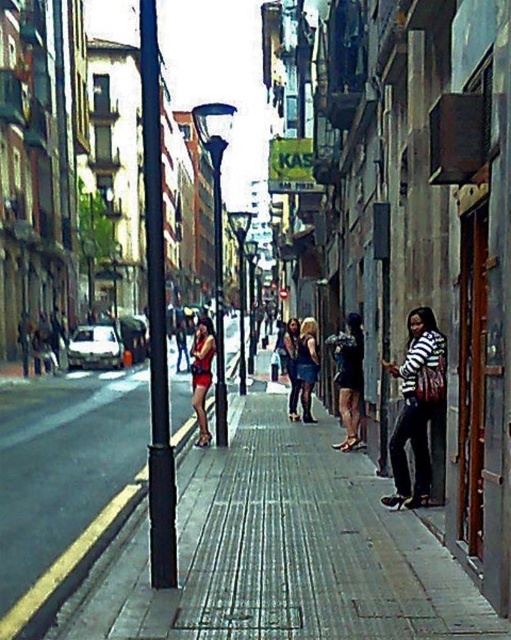
You are a fashion photographer standing on the sidewalk and see both the matte red dress at center and the matte black dress at center. Which dress is positioned closer to you?

The matte red dress at center is closer to the viewer than the matte black dress at center.

You are a fashion designer standing at the edge of the street, and you want to place a new dress that is 1.5 meters long between the matte red dress at center and the matte black dress at center. Is there enough space between them to fit the new dress?

The distance between the matte red dress at center and the matte black dress at center is 2.73 meters. Since the new dress is 1.5 meters long, there is sufficient space to place it between them as 2.73 meters is greater than 1.5 meters.